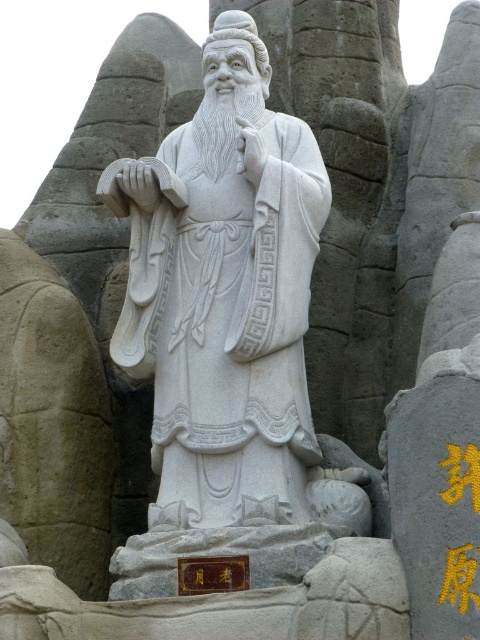
Question: Is white marble statue at center smaller than white stone carving at center?

Choices:
 (A) yes
 (B) no

Answer: (B)

Question: Among these points, which one is farthest from the camera?

Choices:
 (A) (299, 435)
 (B) (238, 304)

Answer: (B)

Question: Does white marble statue at center appear on the right side of white stone carving at center?

Choices:
 (A) yes
 (B) no

Answer: (B)

Question: Among these objects, which one is nearest to the camera?

Choices:
 (A) white stone carving at center
 (B) white marble statue at center

Answer: (B)

Question: Can you confirm if white marble statue at center is positioned above white stone carving at center?

Choices:
 (A) no
 (B) yes

Answer: (A)